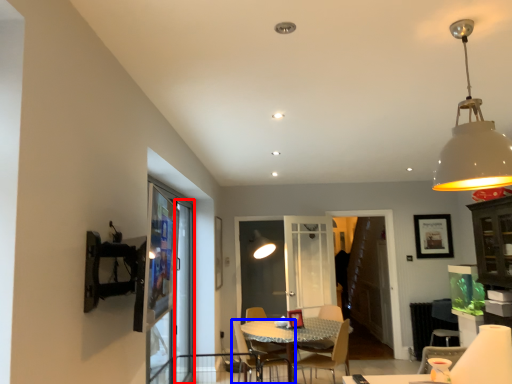
Question: Which point is closer to the camera, screen door (highlighted by a red box) or chair (highlighted by a blue box)?

Choices:
 (A) screen door
 (B) chair

Answer: (B)